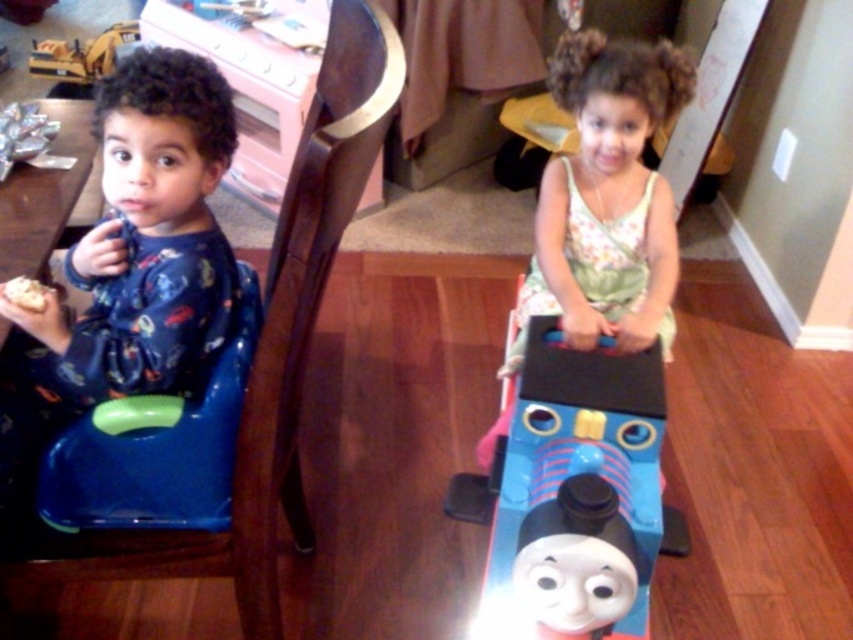
Question: Which of the following is the closest to the observer?

Choices:
 (A) matte blue pajamas at left
 (B) yellow plastic toy at upper left
 (C) white crumbly bread at left
 (D) blue plastic train at center

Answer: (A)

Question: Is blue plastic train at center thinner than floral fabric dress at center?

Choices:
 (A) no
 (B) yes

Answer: (B)

Question: From the image, what is the correct spatial relationship of blue plastic train at center in relation to blue plastic highchair at left?

Choices:
 (A) left
 (B) right

Answer: (B)

Question: Which point appears farthest from the camera in this image?

Choices:
 (A) (335, 10)
 (B) (689, 84)

Answer: (B)

Question: Observing the image, what is the correct spatial positioning of matte blue pajamas at left in reference to blue plastic train at center?

Choices:
 (A) right
 (B) left

Answer: (B)

Question: Which object appears closest to the camera in this image?

Choices:
 (A) white crumbly bread at left
 (B) matte blue pajamas at left
 (C) floral fabric dress at center
 (D) blue plastic train at center

Answer: (B)